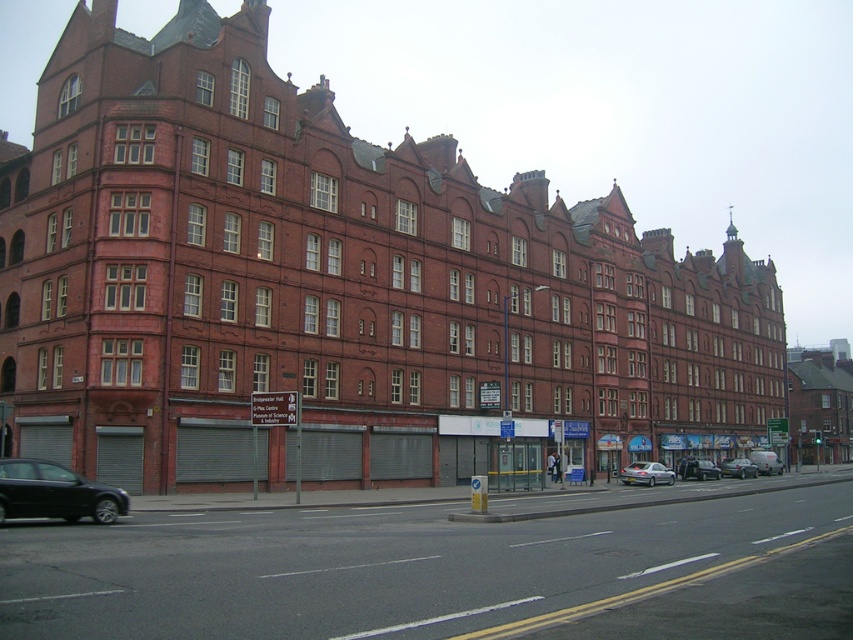
You are a delivery person needing to park your vehicle on the street in front of the building. The parking spot you want is located at point 0.741 on the x axis and 0.758 on the y axis. Is the silver metallic sedan at center currently occupying that exact spot?

Yes, the silver metallic sedan at center is occupying the exact spot at point 0.741 on the x axis and 0.758 on the y axis, so you cannot park there.

You are a pedestrian standing on the sidewalk in front of the large, multi story brick building. You want to cross the street to reach the shiny black sedan at lower left and the silver metallic van at center. The crosswalk is 25 meters away from your current position. Can you safely reach both vehicles without crossing the street again?

The shiny black sedan at lower left is 71.18 meters away from the silver metallic van at center. Since the crosswalk is only 25 meters away from you, after crossing, you can walk to both vehicles within the same side of the street without needing to cross again.

You are a delivery driver who needs to park your vehicle near the shiny black sedan at lower left. According to the street layout, where is the nearest legal parking spot available? Please provide coordinates based on the image grid system.

The nearest legal parking spot would be along the street away from the double yellow line, but the exact coordinates aren not provided in the scene description. However, since the shiny black sedan at lower left is at point (x=54, y=492), you should look for parking spots outside the no parking zones marked by the double yellow line.